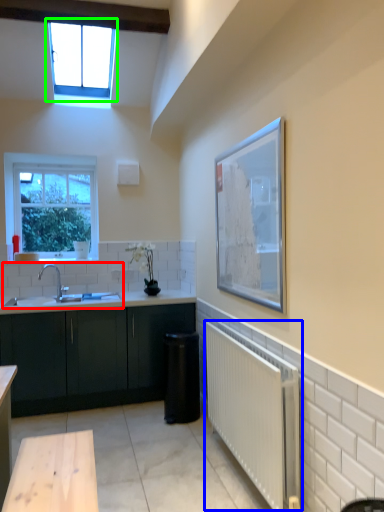
Question: Which object is the closest to the sink (highlighted by a red box)? Choose among these: radiator (highlighted by a blue box) or window (highlighted by a green box).

Choices:
 (A) radiator
 (B) window

Answer: (A)